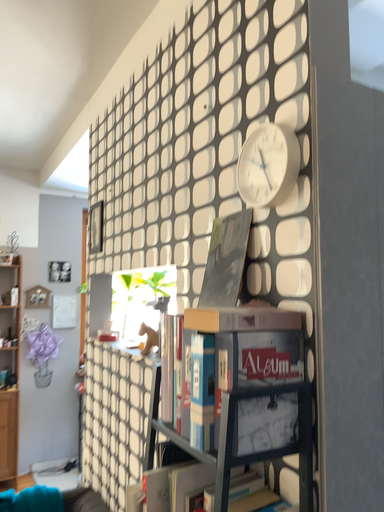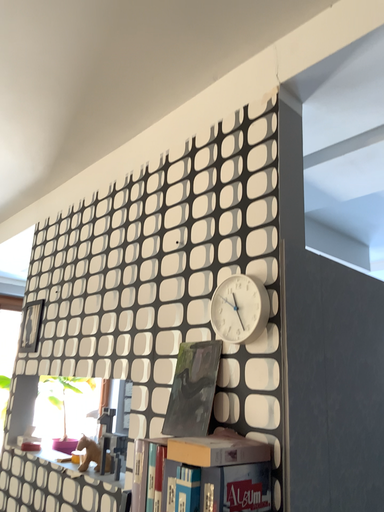
Question: How did the camera likely rotate when shooting the video?

Choices:
 (A) rotated left
 (B) rotated right

Answer: (B)